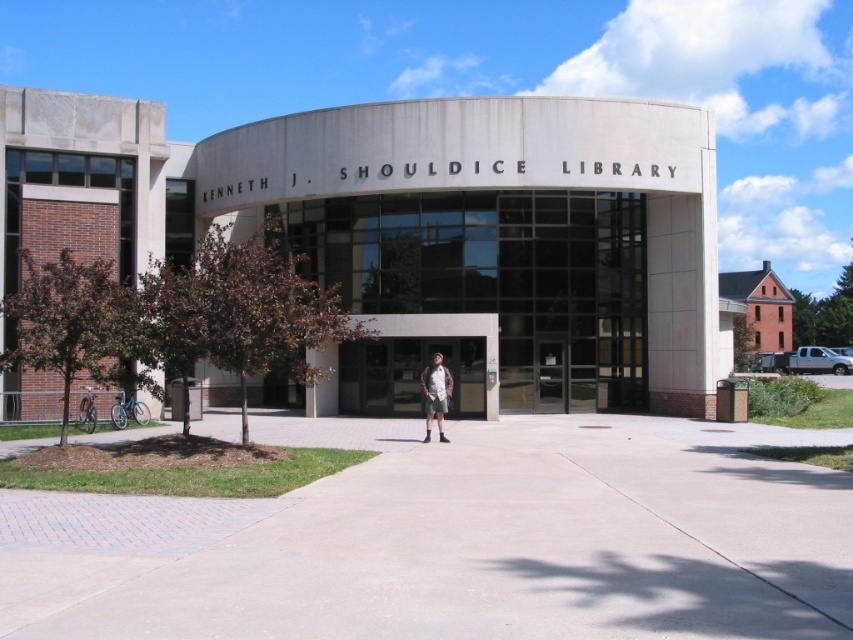
Consider the image. Is concrete at center taller than khaki shorts at center?

No.

Between point (408, 621) and point (428, 403), which one is positioned behind?

Point (428, 403)

I want to click on concrete at center, so 457,540.